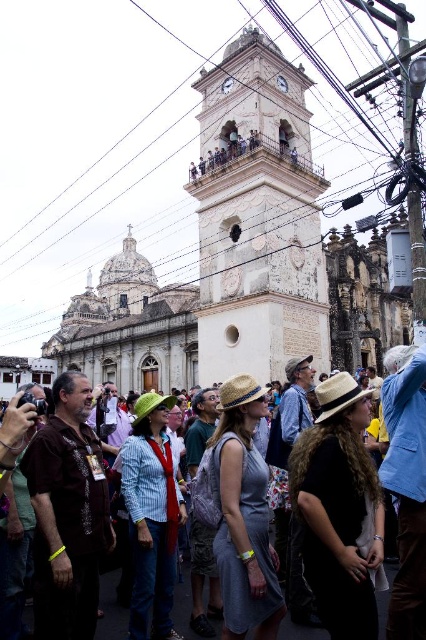
Question: Is denim jacket at center positioned before strawmaterial/texturehat at center?

Choices:
 (A) no
 (B) yes

Answer: (B)

Question: Which of the following is the closest to the observer?

Choices:
 (A) (236, 202)
 (B) (170, 541)
 (C) (362, 470)

Answer: (C)

Question: Which point appears closest to the camera in this image?

Choices:
 (A) (229, 396)
 (B) (60, 22)

Answer: (A)

Question: Is black fabric hat at center smaller than brown fabric shirt at center?

Choices:
 (A) no
 (B) yes

Answer: (B)

Question: Can you confirm if striped cotton shirt at center is positioned to the left of strawmaterial/texturehat at center?

Choices:
 (A) yes
 (B) no

Answer: (A)

Question: Which of the following is the farthest from the observer?

Choices:
 (A) (334, 378)
 (B) (382, 612)

Answer: (A)